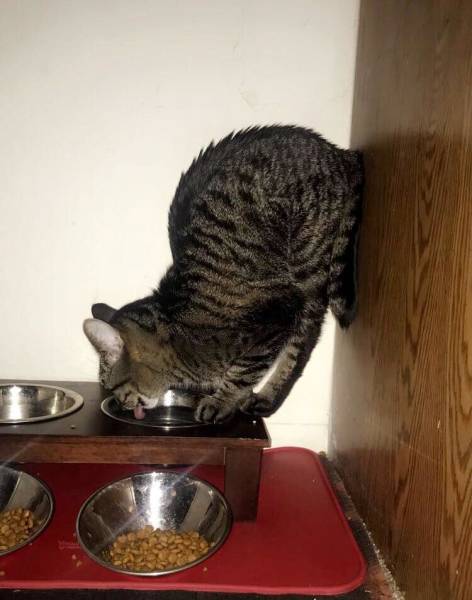
The height and width of the screenshot is (600, 472). I want to click on mat under cat food station, so click(x=308, y=540).